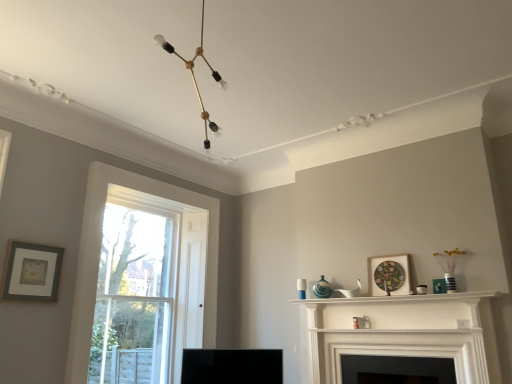
Identify the location of blank space above matte wooden picture frame at upper right, acting as the 2th picture frame starting from the left (from a real-world perspective). (386, 256).